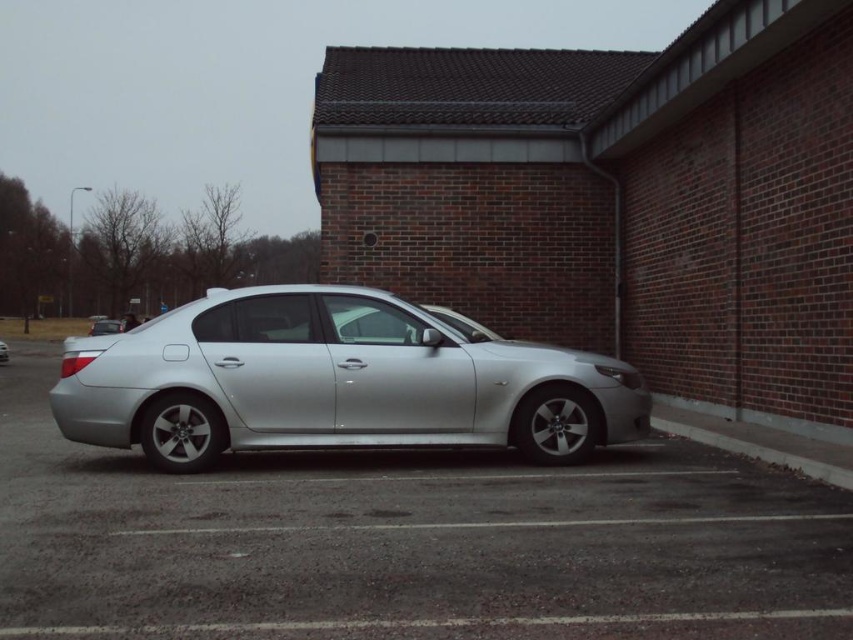
The height and width of the screenshot is (640, 853). Describe the element at coordinates (408, 541) in the screenshot. I see `silver metallic car at center` at that location.

Does silver metallic car at center appear over satin silver car at center?

Actually, silver metallic car at center is below satin silver car at center.

Which is in front, point (135, 504) or point (340, 400)?

Point (135, 504) is in front.

In order to click on silver metallic car at center in this screenshot , I will do `click(408, 541)`.

Can you confirm if satin silver car at center is shorter than gray concrete curb at lower right?

Incorrect, satin silver car at center's height does not fall short of gray concrete curb at lower right's.

Is point (375, 332) farther from viewer compared to point (695, 440)?

That is False.

Who is more distant from viewer, (519, 397) or (712, 426)?

The point (712, 426) is behind.

The image size is (853, 640). Find the location of `satin silver car at center`. satin silver car at center is located at coordinates (334, 381).

Is silver metallic car at center below gray concrete curb at lower right?

Answer: Correct, silver metallic car at center is located below gray concrete curb at lower right.

Locate an element on the screen. silver metallic car at center is located at coordinates (408, 541).